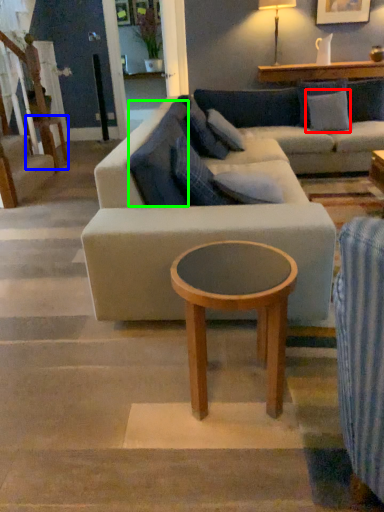
Question: Which is farther away from pillow (highlighted by a red box)? table (highlighted by a blue box) or pillow (highlighted by a green box)?

Choices:
 (A) table
 (B) pillow

Answer: (A)